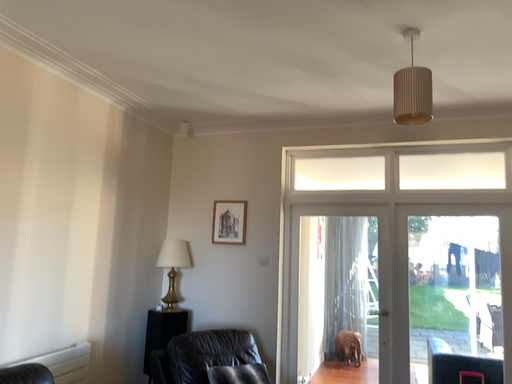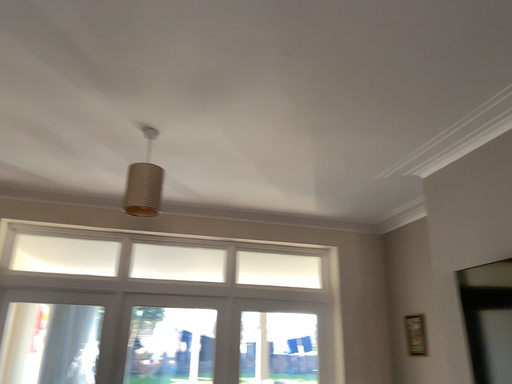
Question: Which way did the camera rotate in the video?

Choices:
 (A) rotated upward
 (B) rotated downward

Answer: (A)